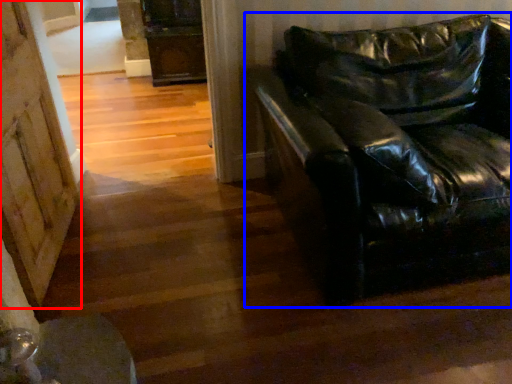
Question: Which of the following is the closest to the observer, barn door (highlighted by a red box) or studio couch (highlighted by a blue box)?

Choices:
 (A) barn door
 (B) studio couch

Answer: (B)